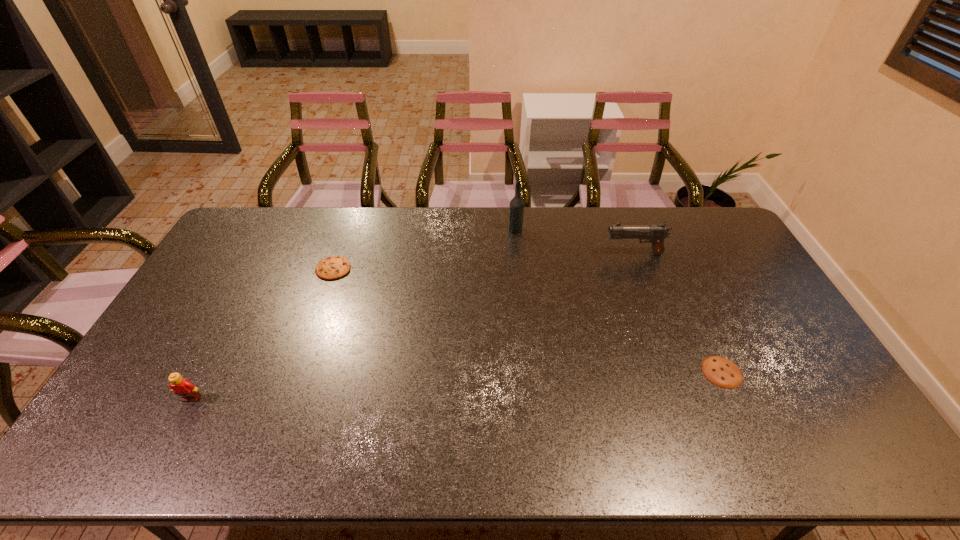
This screenshot has height=540, width=960. Identify the location of vacant point located between the fourth object from right to left and the vodka. (424, 249).

Locate an element on the screen. The image size is (960, 540). free area in between the shorter cookie and the second tallest object is located at coordinates (678, 313).

Where is `free space between the nearer cookie and the third farthest object`? The width and height of the screenshot is (960, 540). free space between the nearer cookie and the third farthest object is located at coordinates (x=528, y=320).

The width and height of the screenshot is (960, 540). In order to click on vacant area between the fourth shortest object and the shortest object in this screenshot , I will do `click(678, 313)`.

Locate an element on the screen. free space between the gun and the farther cookie is located at coordinates (484, 261).

The image size is (960, 540). Find the location of `the second closest object to the third tallest object`. the second closest object to the third tallest object is located at coordinates (516, 208).

Locate an element on the screen. the third closest object to the vodka is located at coordinates (722, 372).

The width and height of the screenshot is (960, 540). Find the location of `vacant region that satisfies the following two spatial constraints: 1. in the direction the fourth shortest object is aimed; 2. on the face of the nearest object`. vacant region that satisfies the following two spatial constraints: 1. in the direction the fourth shortest object is aimed; 2. on the face of the nearest object is located at coordinates click(x=688, y=399).

You are a GUI agent. You are given a task and a screenshot of the screen. Output one action in this format:
    pyautogui.click(x=<x>, y=<y>)
    Task: Click on the vacant space that satisfies the following two spatial constraints: 1. on the back side of the vodka; 2. on the left side of the second object from left to right
    
    Given the screenshot: What is the action you would take?
    pyautogui.click(x=348, y=229)